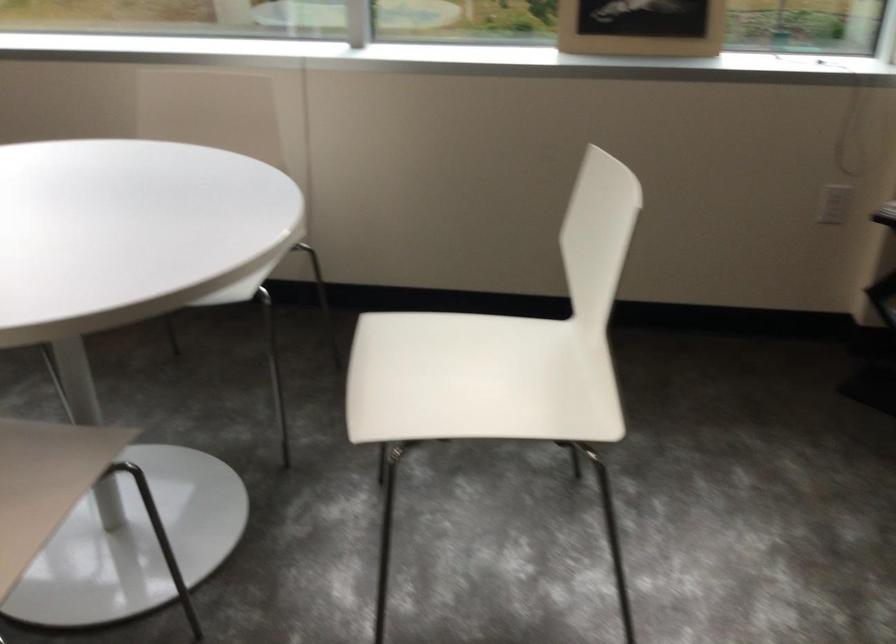
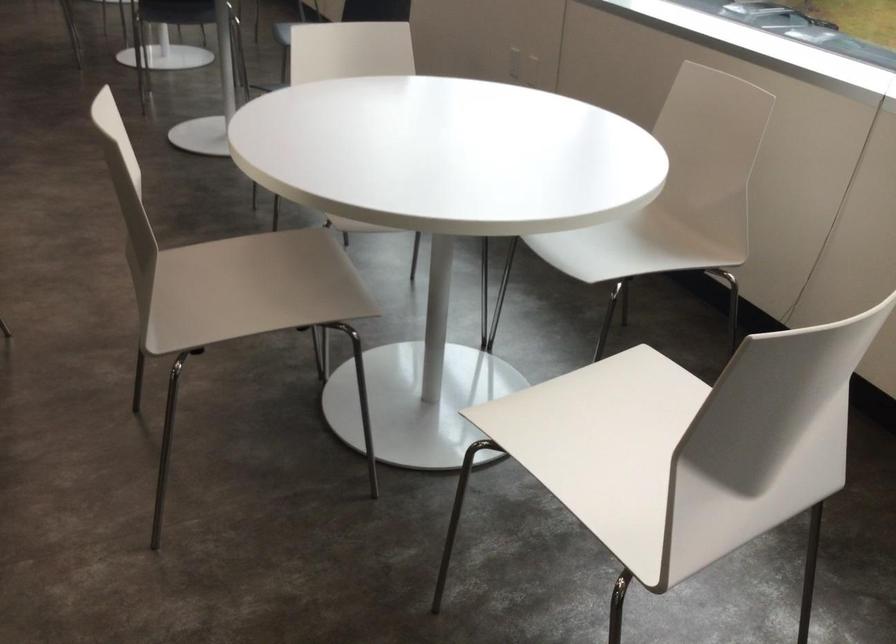
Locate, in the second image, the point that corresponds to (459,382) in the first image.

(604, 444)